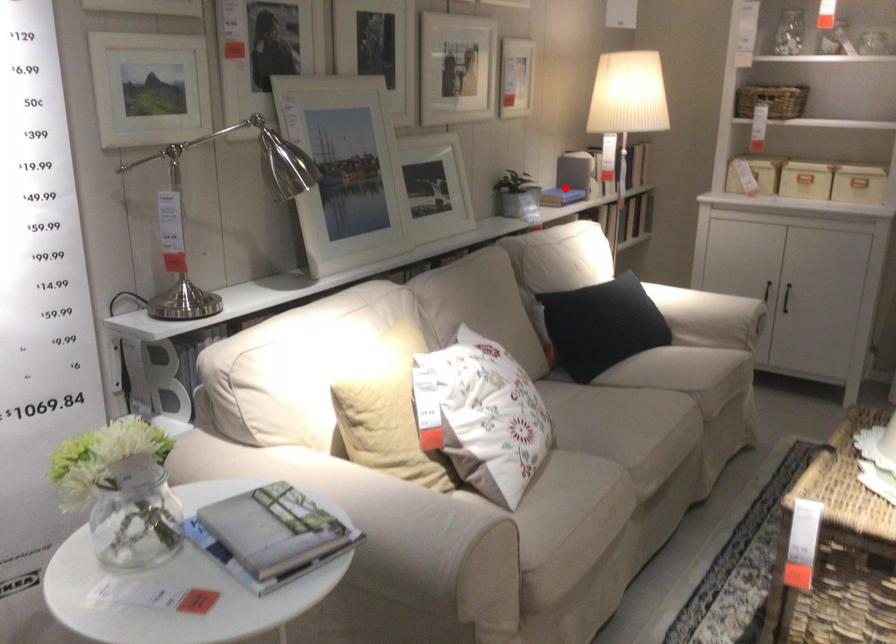
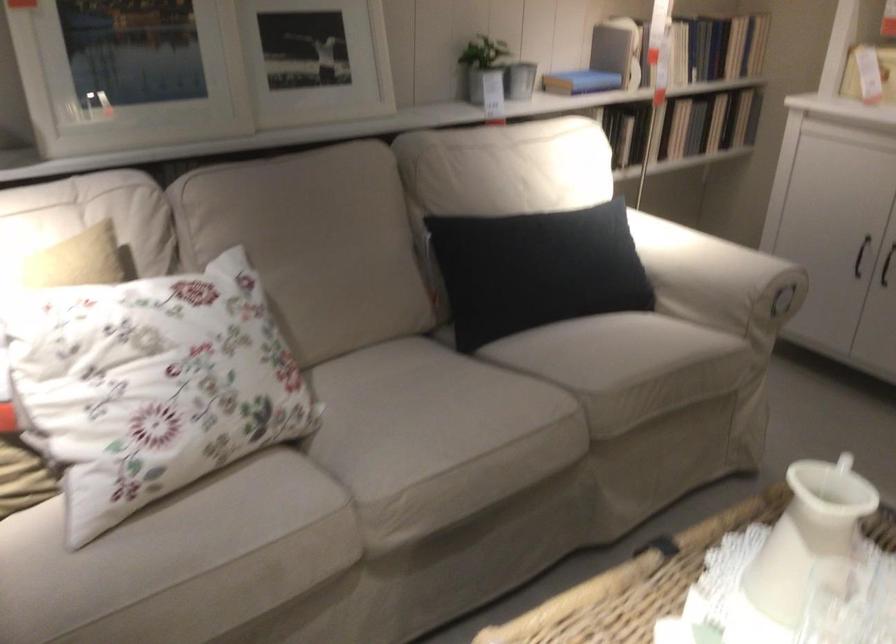
In the second image, find the point that corresponds to the highlighted location in the first image.

(580, 82)